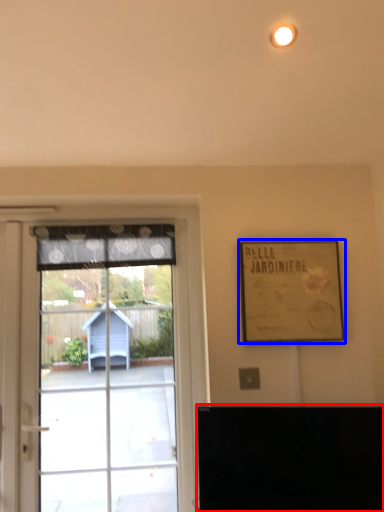
Question: Among these objects, which one is farthest to the camera, furniture (highlighted by a red box) or picture frame (highlighted by a blue box)?

Choices:
 (A) furniture
 (B) picture frame

Answer: (B)